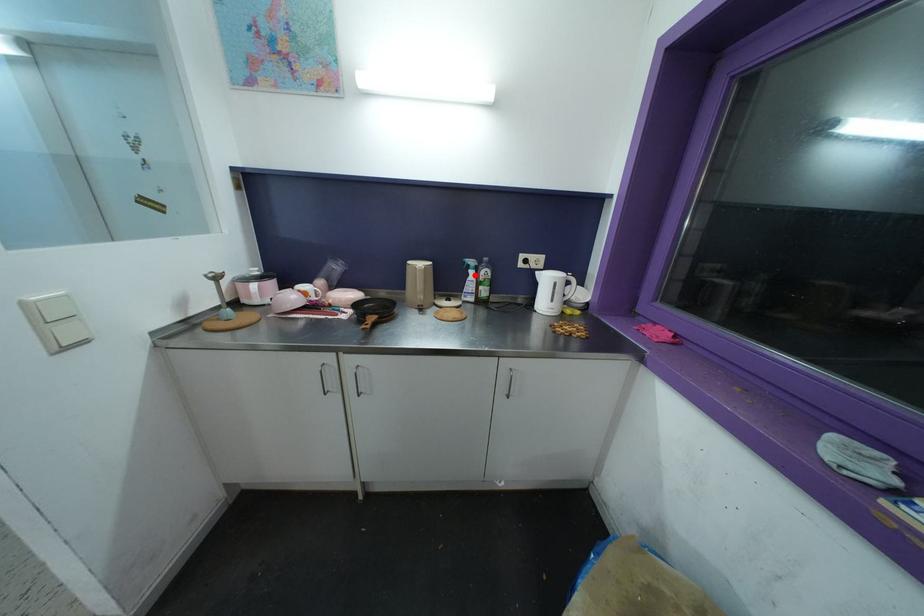
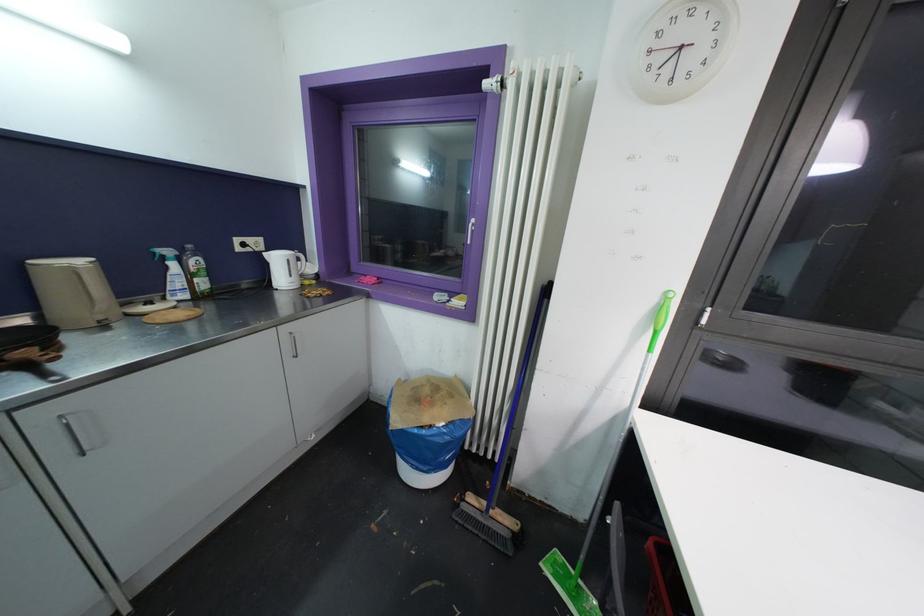
Where in the second image is the point corresponding to the highlighted location from the first image?

(176, 267)